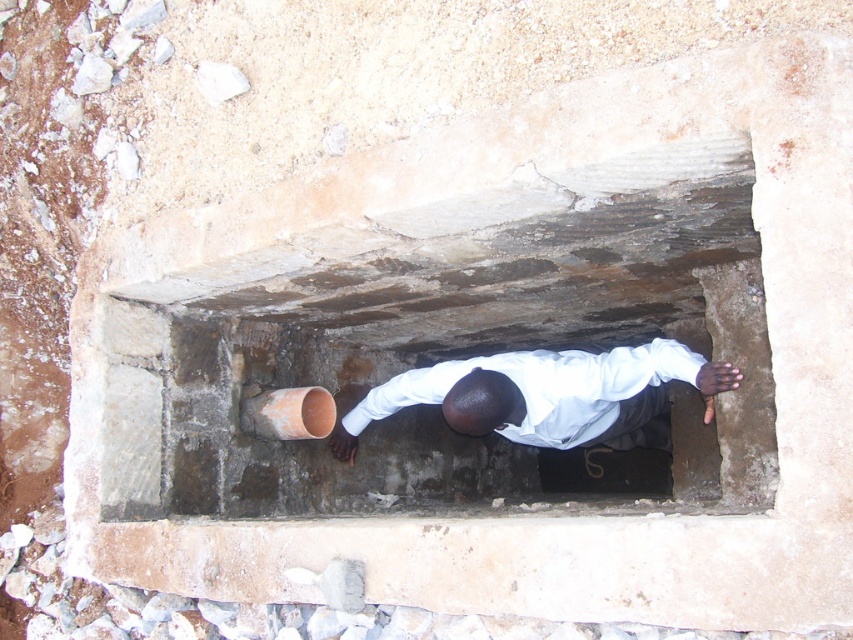
What do you see at coordinates (453, 353) in the screenshot? I see `smooth concrete hole at center` at bounding box center [453, 353].

Who is lower down, smooth concrete hole at center or white matte shirt at center?

smooth concrete hole at center

Is point (228, 321) farther from camera compared to point (636, 388)?

Yes, point (228, 321) is behind point (636, 388).

Find the location of `smooth concrete hole at center`. smooth concrete hole at center is located at coordinates (453, 353).